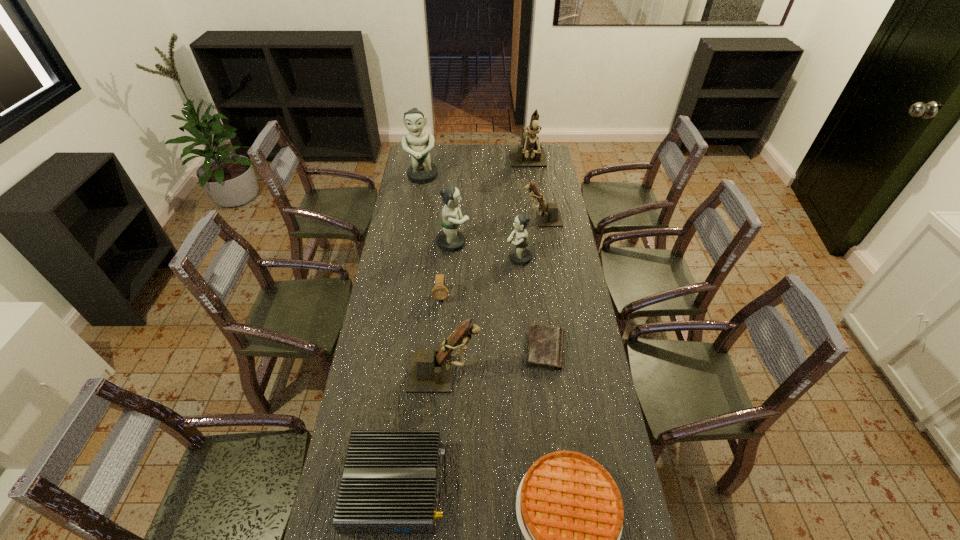
Locate an element on the screen. This screenshot has width=960, height=540. vacant space that satisfies the following two spatial constraints: 1. on the front-facing side of the second nearest brown figurine; 2. on the face of the sixth farthest object is located at coordinates (554, 296).

The height and width of the screenshot is (540, 960). Find the location of `blank space that satisfies the following two spatial constraints: 1. on the front-facing side of the shortest object; 2. on the left side of the farthest green figurine`. blank space that satisfies the following two spatial constraints: 1. on the front-facing side of the shortest object; 2. on the left side of the farthest green figurine is located at coordinates (395, 349).

You are a GUI agent. You are given a task and a screenshot of the screen. Output one action in this format:
    pyautogui.click(x=<x>, y=<y>)
    Task: Click on the free space that satisfies the following two spatial constraints: 1. on the front-facing side of the third farthest object; 2. on the face of the watch
    This screenshot has width=960, height=540.
    Given the screenshot: What is the action you would take?
    pyautogui.click(x=554, y=296)

At what (x,y) coordinates should I click in order to perform the action: click on vacant area that satisfies the following two spatial constraints: 1. on the front-facing side of the rightmost green figurine; 2. on the face of the watch. Please return your answer as a coordinate pair (x, y). The height and width of the screenshot is (540, 960). Looking at the image, I should click on (522, 296).

Image resolution: width=960 pixels, height=540 pixels. Identify the location of vacant area that satisfies the following two spatial constraints: 1. on the front-facing side of the farthest green figurine; 2. on the left side of the diary. (395, 349).